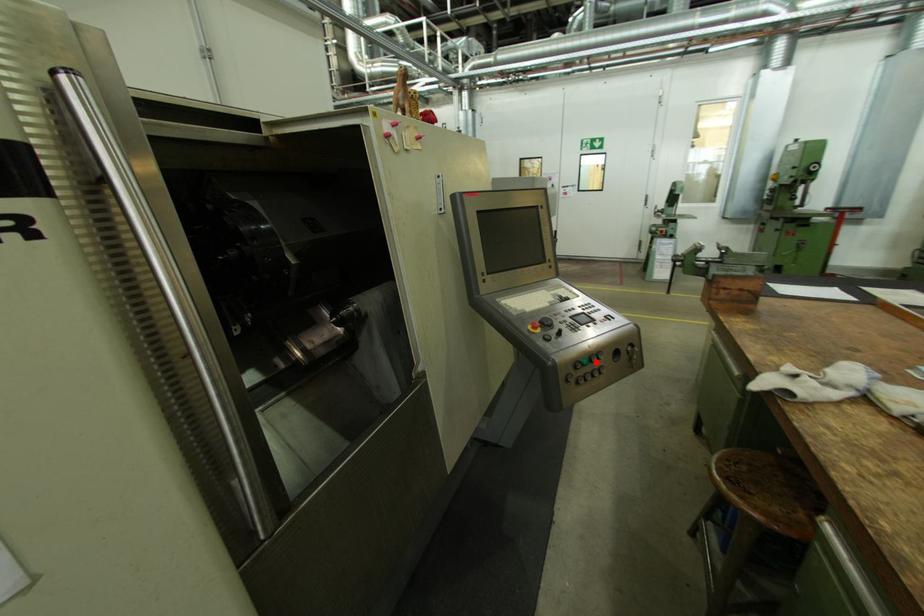
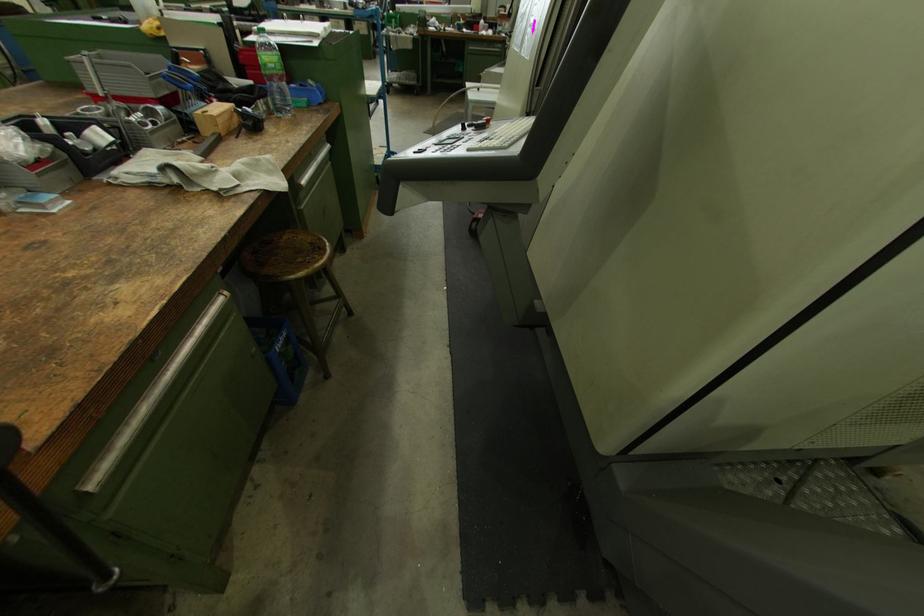
Question: I am providing you with two images of the same scene from different viewpoints. A red point is marked on the first image. Can you still see the location of the red point in image 2?

Choices:
 (A) Yes
 (B) No

Answer: (B)